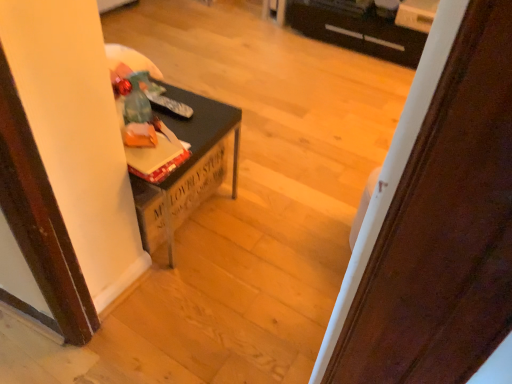
The height and width of the screenshot is (384, 512). I want to click on black plastic drawer at upper center, so click(356, 29).

Are matte black table at left and wooden door at center making contact?

No, matte black table at left is not touching wooden door at center.

Can you tell me how much matte black table at left and wooden door at center differ in facing direction?

77.6 degrees.

Is matte black table at left turned away from wooden door at center?

No, matte black table at left is not facing the opposite direction of wooden door at center.

The height and width of the screenshot is (384, 512). In order to click on table above the wooden door at center (from the image's perspective) in this screenshot , I will do `click(186, 167)`.

Considering the relative sizes of wooden door at center and black plastic drawer at upper center in the image provided, is wooden door at center taller than black plastic drawer at upper center?

Yes, wooden door at center is taller than black plastic drawer at upper center.

Considering the relative positions of wooden door at center and black plastic drawer at upper center in the image provided, is wooden door at center to the left of black plastic drawer at upper center from the viewer's perspective?

Indeed, wooden door at center is positioned on the left side of black plastic drawer at upper center.

From the image's perspective, relative to black plastic drawer at upper center, is wooden door at center above or below?

Based on their image positions, wooden door at center is located beneath black plastic drawer at upper center.

Would you say black plastic drawer at upper center is part of wooden door at center's contents?

No, black plastic drawer at upper center is located outside of wooden door at center.

Is black plastic drawer at upper center facing towards matte black table at left?

Yes, black plastic drawer at upper center is oriented towards matte black table at left.

Is black plastic drawer at upper center outside of matte black table at left?

Yes.

Considering the relative sizes of black plastic drawer at upper center and matte black table at left in the image provided, is black plastic drawer at upper center taller than matte black table at left?

In fact, black plastic drawer at upper center may be shorter than matte black table at left.

What's the angular difference between black plastic drawer at upper center and matte black table at left's facing directions?

The facing directions of black plastic drawer at upper center and matte black table at left are 176 degrees apart.

Is wooden door at center inside or outside of matte black table at left?

wooden door at center is not enclosed by matte black table at left.

Is wooden door at center directly adjacent to matte black table at left?

wooden door at center is not next to matte black table at left, and they're not touching.

Which object is more forward, wooden door at center or matte black table at left?

wooden door at center.

Considering the relative sizes of wooden door at center and matte black table at left in the image provided, is wooden door at center bigger than matte black table at left?

Actually, wooden door at center might be smaller than matte black table at left.

Which object is further away from the camera taking this photo, matte black table at left or black plastic drawer at upper center?

black plastic drawer at upper center is behind.

From the image's perspective, which is above, matte black table at left or black plastic drawer at upper center?

black plastic drawer at upper center, from the image's perspective.

In the scene shown: From a real-world perspective, which is physically above, matte black table at left or black plastic drawer at upper center?

In real-world perspective, matte black table at left is above.

From the image's perspective, is black plastic drawer at upper center beneath wooden door at center?

No.

Between black plastic drawer at upper center and wooden door at center, which one is positioned in front?

wooden door at center is closer to the camera.

Can you tell me how much black plastic drawer at upper center and wooden door at center differ in facing direction?

The angle between the facing direction of black plastic drawer at upper center and the facing direction of wooden door at center is 98.3 degrees.

From a real-world perspective, is black plastic drawer at upper center below wooden door at center?

Yes, from a real-world perspective, black plastic drawer at upper center is beneath wooden door at center.

What are the coordinates of `table above the wooden door at center (from the image's perspective)` in the screenshot? It's located at (186, 167).

At what (x,y) coordinates should I click in order to perform the action: click on door above the black plastic drawer at upper center (from a real-world perspective). Please return your answer as a coordinate pair (x, y). The height and width of the screenshot is (384, 512). Looking at the image, I should click on (444, 229).

Which object lies further to the anchor point matte black table at left, black plastic drawer at upper center or wooden door at center?

black plastic drawer at upper center.

From the image, which object appears to be farther from black plastic drawer at upper center, wooden door at center or matte black table at left?

wooden door at center.

Considering their positions, is black plastic drawer at upper center positioned closer to wooden door at center than matte black table at left?

matte black table at left is closer to wooden door at center.

From the image, which object appears to be nearer to black plastic drawer at upper center, matte black table at left or wooden door at center?

matte black table at left is positioned closer to the anchor black plastic drawer at upper center.

Considering their positions, is matte black table at left positioned closer to wooden door at center than black plastic drawer at upper center?

The object closer to wooden door at center is matte black table at left.

Considering their positions, is wooden door at center positioned closer to matte black table at left than black plastic drawer at upper center?

wooden door at center is closer to matte black table at left.

Locate an element on the screen. table between wooden door at center and black plastic drawer at upper center along the z-axis is located at coordinates (186, 167).